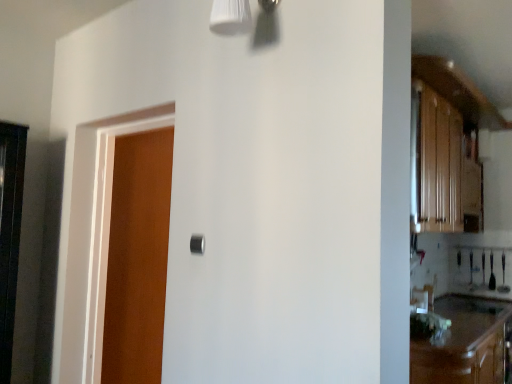
Question: Is black matte door handle at center looking in the opposite direction of brown wood cabinetry at lower right?

Choices:
 (A) no
 (B) yes

Answer: (A)

Question: Is black matte door handle at center not close to brown wood cabinetry at lower right?

Choices:
 (A) no
 (B) yes

Answer: (B)

Question: Could you tell me if black matte door handle at center is facing brown wood cabinetry at lower right?

Choices:
 (A) yes
 (B) no

Answer: (B)

Question: Is brown wood cabinetry at lower right inside black matte door handle at center?

Choices:
 (A) yes
 (B) no

Answer: (B)

Question: Does black matte door handle at center have a greater width compared to brown wood cabinetry at lower right?

Choices:
 (A) yes
 (B) no

Answer: (B)

Question: Relative to wooden door at left, is brown wood cabinetry at lower right in front or behind?

Choices:
 (A) front
 (B) behind

Answer: (A)

Question: Is brown wood cabinetry at lower right taller or shorter than wooden door at left?

Choices:
 (A) tall
 (B) short

Answer: (B)

Question: Looking at their shapes, would you say brown wood cabinetry at lower right is wider or thinner than wooden door at left?

Choices:
 (A) wide
 (B) thin

Answer: (A)

Question: From a real-world perspective, is brown wood cabinetry at lower right positioned above or below wooden door at left?

Choices:
 (A) below
 (B) above

Answer: (A)

Question: Is black matte door handle at center situated inside wooden door at left or outside?

Choices:
 (A) outside
 (B) inside

Answer: (A)

Question: From the image's perspective, is black matte door handle at center above or below wooden door at left?

Choices:
 (A) above
 (B) below

Answer: (A)

Question: Is black matte door handle at center in front of or behind wooden door at left in the image?

Choices:
 (A) front
 (B) behind

Answer: (A)

Question: Is black matte door handle at center to the left or to the right of wooden door at left in the image?

Choices:
 (A) right
 (B) left

Answer: (A)

Question: Based on their positions, is wooden door at left located to the left or right of black matte door handle at center?

Choices:
 (A) left
 (B) right

Answer: (A)

Question: Considering the positions of point (158, 160) and point (203, 251), is point (158, 160) closer or farther from the camera than point (203, 251)?

Choices:
 (A) closer
 (B) farther

Answer: (B)